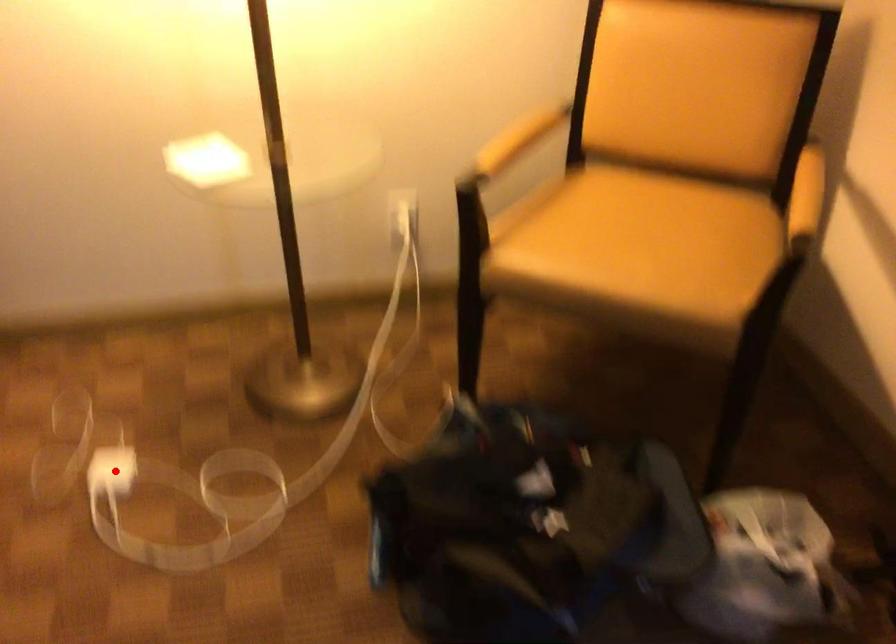
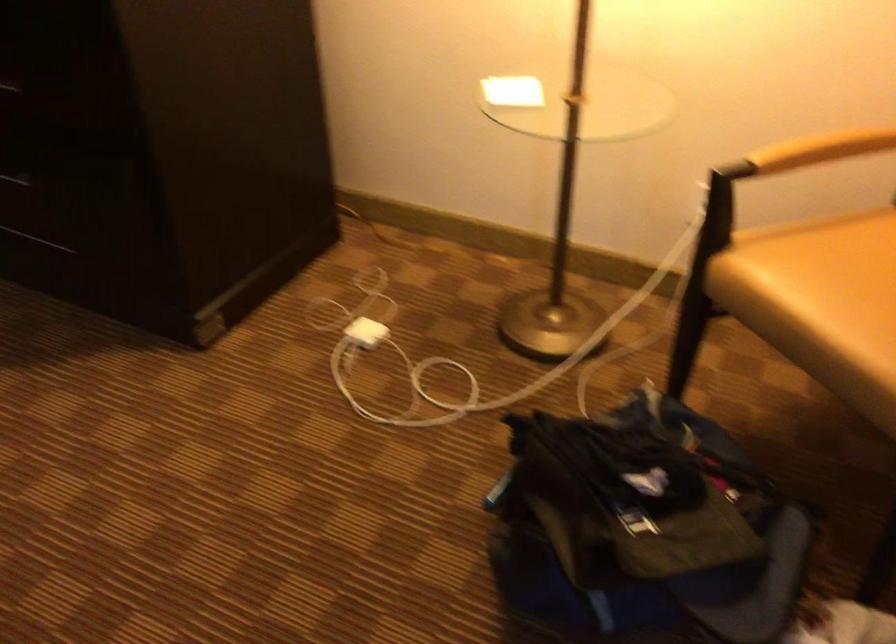
Question: I am providing you with two images of the same scene from different viewpoints. Image1 has a red point marked. In image2, the corresponding 3D location appears at what relative position? Reply with the corresponding letter.

Choices:
 (A) Closer
 (B) Farther

Answer: (B)